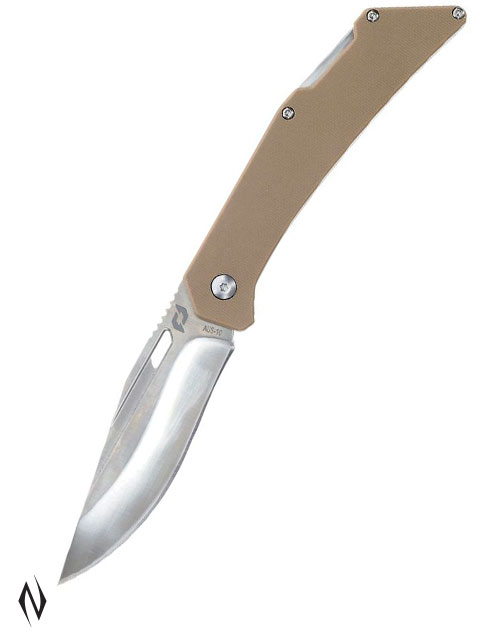
Locate an element on the screen. This screenshot has height=640, width=480. handle is located at coordinates (277, 192).